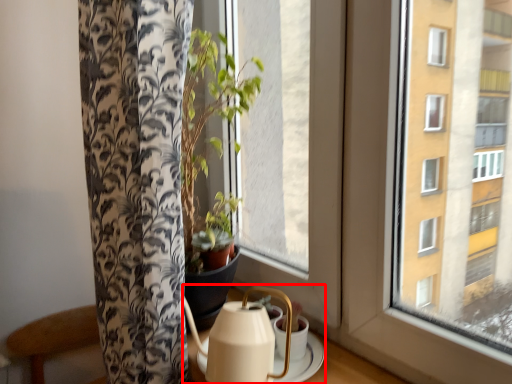
Question: From the image's perspective, what is the correct spatial relationship of tea set (annotated by the red box) in relation to window?

Choices:
 (A) below
 (B) above

Answer: (A)